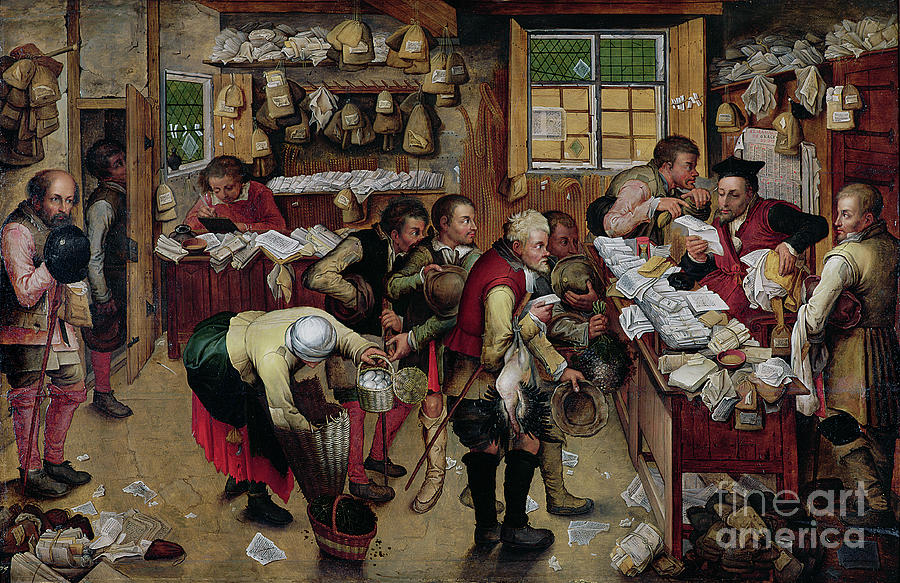
The width and height of the screenshot is (900, 583). I want to click on 1 entrance, so click(x=146, y=178).